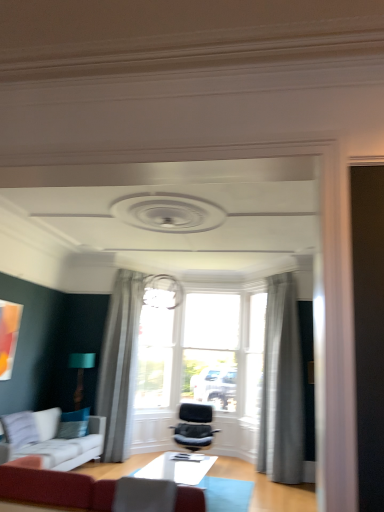
Question: Is gray sheer curtain at center, marked as the 1th curtain in a left-to-right arrangement, at the left side of velvet red sofa at lower left, the second studio couch from the left?

Choices:
 (A) no
 (B) yes

Answer: (B)

Question: From the image's perspective, would you say gray sheer curtain at center, marked as the 1th curtain in a left-to-right arrangement, is shown under velvet red sofa at lower left, the second studio couch from the left?

Choices:
 (A) no
 (B) yes

Answer: (A)

Question: Is gray sheer curtain at center, arranged as the 2th curtain when viewed from the right, completely or partially outside of velvet red sofa at lower left, arranged as the 1th studio couch when viewed from the front?

Choices:
 (A) yes
 (B) no

Answer: (A)

Question: From a real-world perspective, is gray sheer curtain at center, arranged as the 2th curtain when viewed from the right, beneath velvet red sofa at lower left, which appears as the second studio couch when viewed from the back?

Choices:
 (A) no
 (B) yes

Answer: (A)

Question: Considering the relative positions of gray sheer curtain at center, arranged as the 2th curtain when viewed from the right, and velvet red sofa at lower left, which appears as the second studio couch when viewed from the back, in the image provided, is gray sheer curtain at center, arranged as the 2th curtain when viewed from the right, behind velvet red sofa at lower left, which appears as the second studio couch when viewed from the back,?

Choices:
 (A) no
 (B) yes

Answer: (B)

Question: Is gray sheer curtain at center, marked as the 1th curtain in a left-to-right arrangement, thinner than velvet red sofa at lower left, marked as the 1th studio couch in a right-to-left arrangement?

Choices:
 (A) no
 (B) yes

Answer: (B)

Question: Can we say teal fabric pillow at lower left lies outside white glossy table at center?

Choices:
 (A) no
 (B) yes

Answer: (B)

Question: Does teal fabric pillow at lower left have a smaller size compared to white glossy table at center?

Choices:
 (A) yes
 (B) no

Answer: (A)

Question: From a real-world perspective, is teal fabric pillow at lower left positioned over white glossy table at center based on gravity?

Choices:
 (A) yes
 (B) no

Answer: (A)

Question: Is teal fabric pillow at lower left wider than white glossy table at center?

Choices:
 (A) no
 (B) yes

Answer: (A)

Question: Is teal fabric pillow at lower left oriented away from white glossy table at center?

Choices:
 (A) no
 (B) yes

Answer: (A)

Question: Can you confirm if teal fabric pillow at lower left is thinner than white glossy table at center?

Choices:
 (A) yes
 (B) no

Answer: (A)

Question: Is white glossy table at center outside of teal fabric pillow at lower left?

Choices:
 (A) no
 (B) yes

Answer: (B)